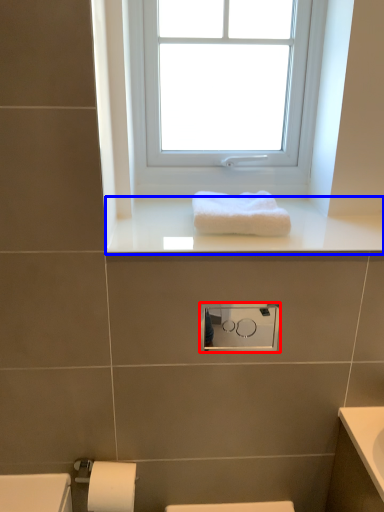
Question: Among these objects, which one is nearest to the camera, medicine cabinet (highlighted by a red box) or window sill (highlighted by a blue box)?

Choices:
 (A) medicine cabinet
 (B) window sill

Answer: (B)